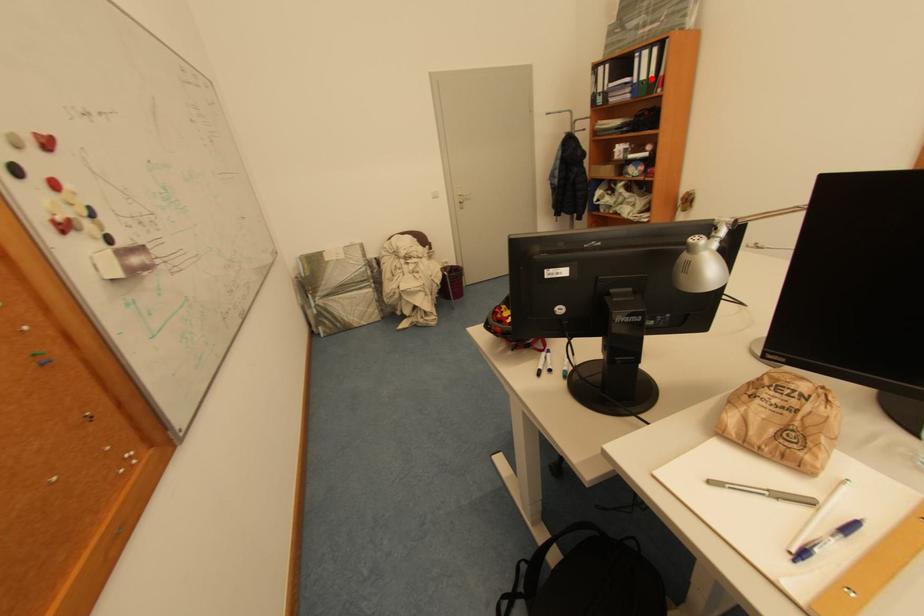
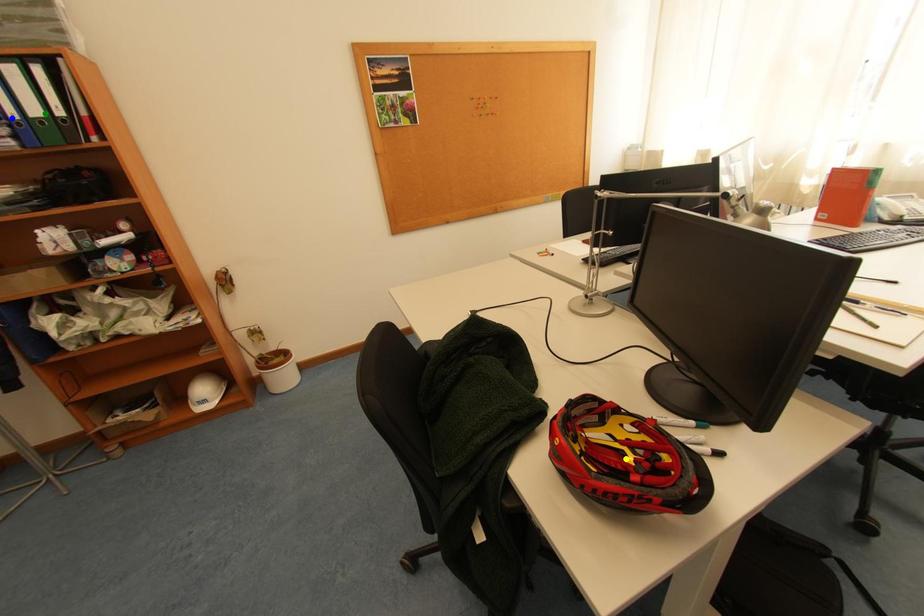
Question: I am providing you with two images of the same scene from different viewpoints. A red point is marked on the first image. You are given multiple points on the second image. Which spot in image 2 lines up with the point in image 1?

Choices:
 (A) blue point
 (B) yellow point
 (C) green point

Answer: (C)